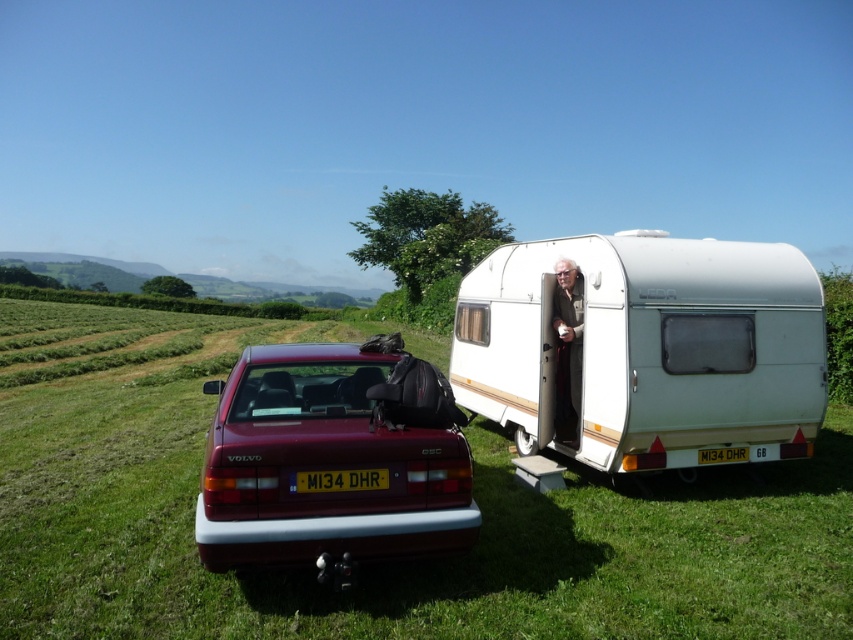
Question: Which point is closer to the camera taking this photo?

Choices:
 (A) click(705, 604)
 (B) click(722, 452)

Answer: (A)

Question: Which of these objects is positioned farthest from the black plastic license plate at center?

Choices:
 (A) shiny maroon car at center
 (B) white plastic license plate at center
 (C) light brown leather jacket at center
 (D) green grassy field at center

Answer: (D)

Question: Can you confirm if green grassy field at center is positioned below shiny maroon car at center?

Choices:
 (A) no
 (B) yes

Answer: (B)

Question: Is green grassy field at center above white plastic caravan at right?

Choices:
 (A) yes
 (B) no

Answer: (B)

Question: Does white plastic caravan at right appear over light brown leather jacket at center?

Choices:
 (A) yes
 (B) no

Answer: (A)

Question: Which is farther from the black plastic license plate at center?

Choices:
 (A) light brown leather jacket at center
 (B) white plastic caravan at right
 (C) shiny maroon car at center

Answer: (B)